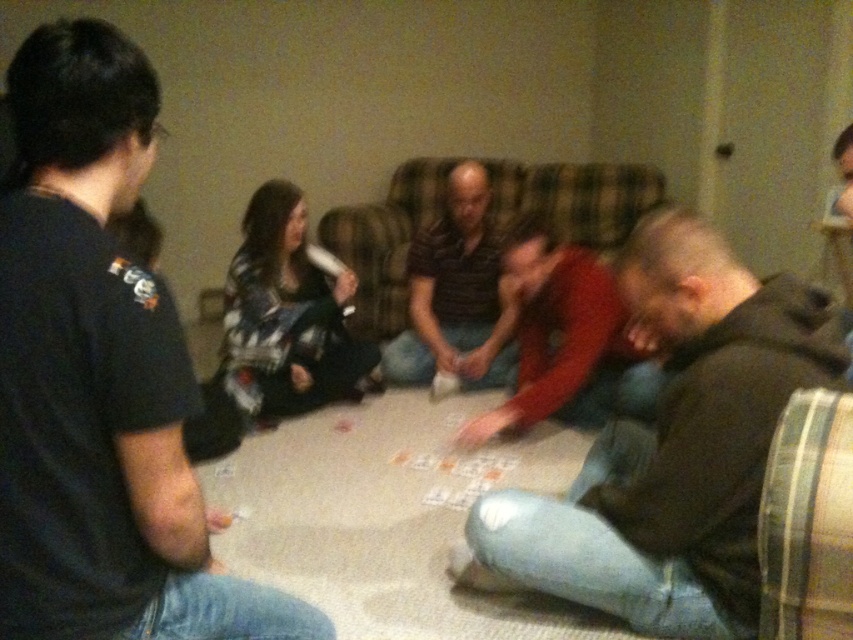
Question: Is the position of dark gray hoodie at lower right more distant than that of striped cotton shirt at center?

Choices:
 (A) no
 (B) yes

Answer: (A)

Question: Which of the following is the closest to the observer?

Choices:
 (A) (486, 353)
 (B) (527, 280)
 (C) (515, 166)

Answer: (B)

Question: Which point is farther to the camera?

Choices:
 (A) 494,429
 (B) 54,250
 (C) 614,220
 (D) 821,301

Answer: (C)

Question: Which of the following is the closest to the observer?

Choices:
 (A) (473, 352)
 (B) (68, 33)
 (C) (381, 228)
 (D) (637, 620)

Answer: (B)

Question: Can you confirm if dark gray hoodie at lower right is bigger than striped cotton shirt at center?

Choices:
 (A) yes
 (B) no

Answer: (A)

Question: Is dark gray hoodie at lower right closer to the viewer compared to striped cotton shirt at center?

Choices:
 (A) no
 (B) yes

Answer: (B)